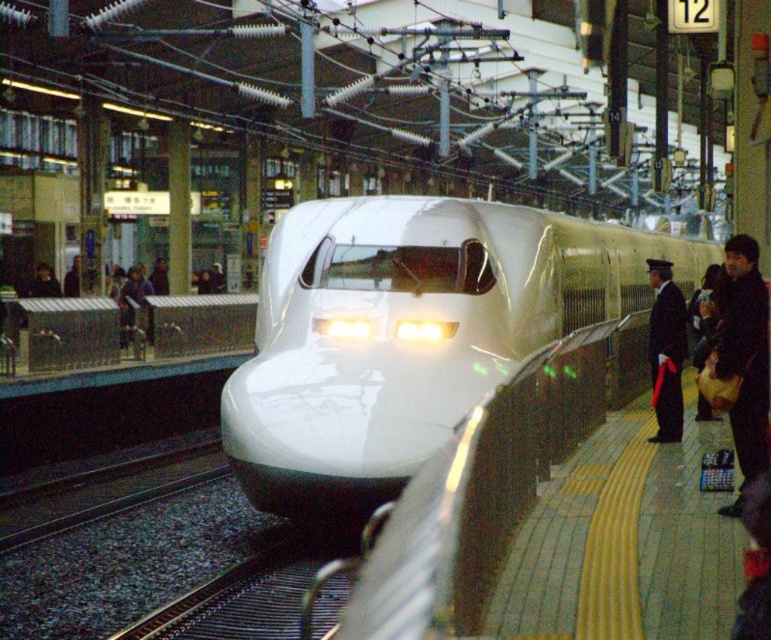
Question: Does white glossy bullet train at center appear over dark gray fabric jacket at right?

Choices:
 (A) yes
 (B) no

Answer: (A)

Question: Considering the real-world distances, which object is closest to the white glossy bullet train at center?

Choices:
 (A) dark blue uniform at right
 (B) dark gray fabric jacket at right

Answer: (B)

Question: Estimate the real-world distances between objects in this image. Which object is closer to the white glossy bullet train at center?

Choices:
 (A) dark gray fabric jacket at right
 (B) dark blue uniform at right

Answer: (A)

Question: Does dark gray fabric jacket at right appear on the right side of dark blue uniform at right?

Choices:
 (A) no
 (B) yes

Answer: (B)

Question: Is white glossy bullet train at center behind dark blue uniform at right?

Choices:
 (A) no
 (B) yes

Answer: (A)

Question: Which point is farther from the camera taking this photo?

Choices:
 (A) (722, 252)
 (B) (658, 406)

Answer: (A)